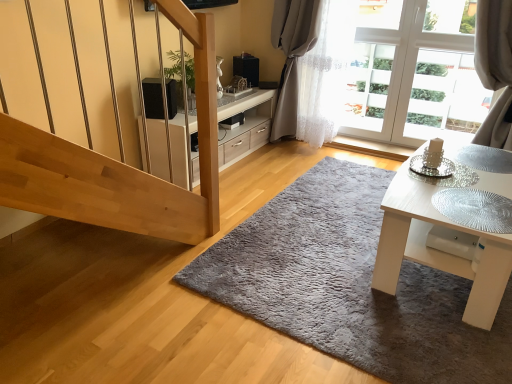
Question: From a real-world perspective, is white sheer curtain at upper right over gray fluffy rug at center?

Choices:
 (A) no
 (B) yes

Answer: (B)

Question: Is white sheer curtain at upper right outside gray fluffy rug at center?

Choices:
 (A) yes
 (B) no

Answer: (A)

Question: Is white sheer curtain at upper right at the right side of gray fluffy rug at center?

Choices:
 (A) no
 (B) yes

Answer: (A)

Question: Can you confirm if white sheer curtain at upper right is thinner than gray fluffy rug at center?

Choices:
 (A) yes
 (B) no

Answer: (A)

Question: Considering the relative sizes of white sheer curtain at upper right and gray fluffy rug at center in the image provided, is white sheer curtain at upper right smaller than gray fluffy rug at center?

Choices:
 (A) no
 (B) yes

Answer: (A)

Question: Is white glossy cabinet at center situated inside white sheer curtain at upper right or outside?

Choices:
 (A) outside
 (B) inside

Answer: (A)

Question: Relative to white sheer curtain at upper right, is white glossy cabinet at center in front or behind?

Choices:
 (A) front
 (B) behind

Answer: (A)

Question: From the image's perspective, is white glossy cabinet at center located above or below white sheer curtain at upper right?

Choices:
 (A) below
 (B) above

Answer: (A)

Question: From a real-world perspective, is white glossy cabinet at center above or below white sheer curtain at upper right?

Choices:
 (A) below
 (B) above

Answer: (A)

Question: From a real-world perspective, relative to white glossy cabinet at center, is white glossy table at lower right vertically above or below?

Choices:
 (A) below
 (B) above

Answer: (B)

Question: From the image's perspective, is white glossy table at lower right located above or below white glossy cabinet at center?

Choices:
 (A) above
 (B) below

Answer: (B)

Question: Considering the relative positions of white glossy table at lower right and white glossy cabinet at center in the image provided, is white glossy table at lower right to the left or to the right of white glossy cabinet at center?

Choices:
 (A) right
 (B) left

Answer: (A)

Question: Do you think white glossy table at lower right is within white glossy cabinet at center, or outside of it?

Choices:
 (A) outside
 (B) inside

Answer: (A)

Question: Based on their positions, is gray fluffy rug at center located to the left or right of white glossy table at lower right?

Choices:
 (A) left
 (B) right

Answer: (A)

Question: Is gray fluffy rug at center in front of or behind white glossy table at lower right in the image?

Choices:
 (A) behind
 (B) front

Answer: (B)